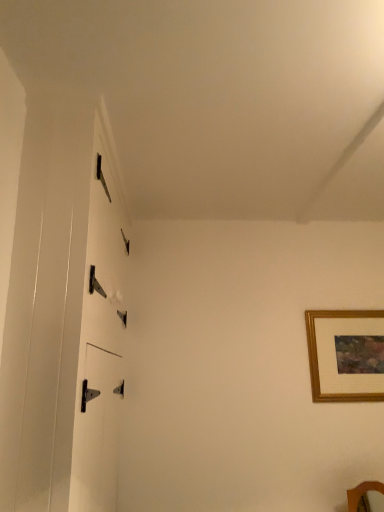
At what (x,y) coordinates should I click in order to perform the action: click on gold wooden picture frame at upper right. Please return your answer as a coordinate pair (x, y). The width and height of the screenshot is (384, 512). Looking at the image, I should click on (346, 355).

The image size is (384, 512). What do you see at coordinates (346, 355) in the screenshot?
I see `gold wooden picture frame at upper right` at bounding box center [346, 355].

Image resolution: width=384 pixels, height=512 pixels. I want to click on gold wooden picture frame at upper right, so click(x=346, y=355).